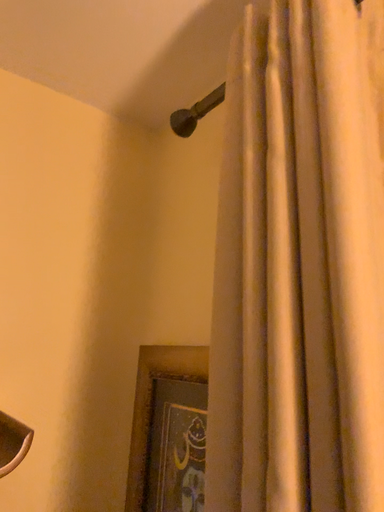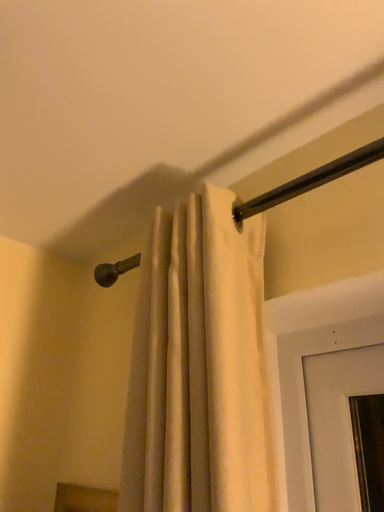
Question: Which way did the camera rotate in the video?

Choices:
 (A) rotated left
 (B) rotated right

Answer: (B)